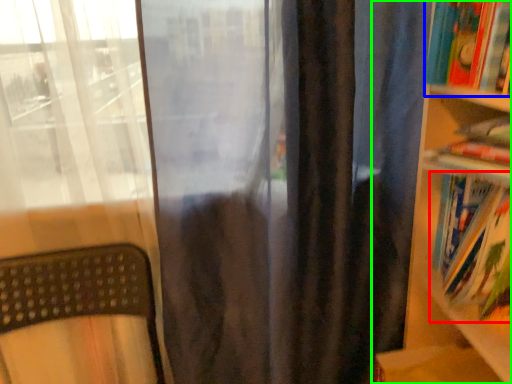
Question: Considering the real-world distances, which object is closest to book (highlighted by a red box)? book (highlighted by a blue box) or bookcase (highlighted by a green box).

Choices:
 (A) book
 (B) bookcase

Answer: (B)